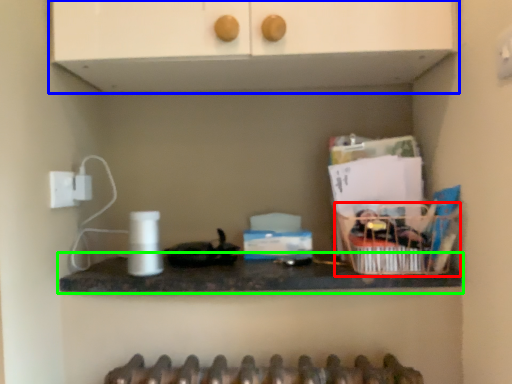
Question: Which is nearer to the basket (highlighted by a red box)? cabinetry (highlighted by a blue box) or countertop (highlighted by a green box).

Choices:
 (A) cabinetry
 (B) countertop

Answer: (B)